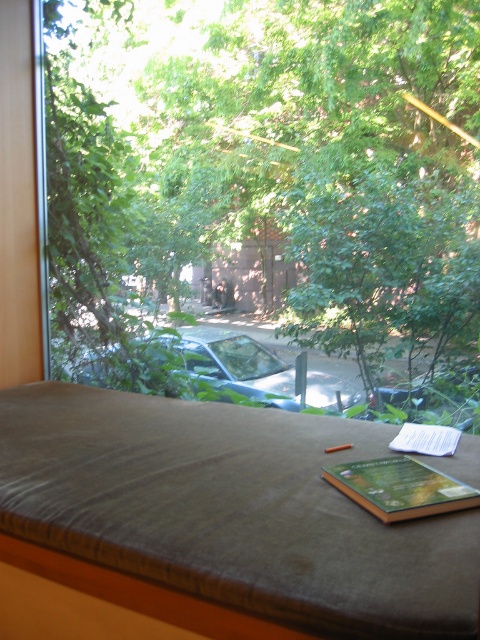
You are an interior designer planning to place a new floor lamp in this room. The lamp is 1.8 meters tall. Considering the height of the green leafy tree at center and the hardcover book at center, which object would the lamp be taller than?

The lamp at 1.8 meters would be taller than both the green leafy tree at center and the hardcover book at center since the tree is taller than the book, but the lamp is taller than the tree.

You are standing in the room and want to take a photo of the metallic silver car at center through the window. Considering the open book with green cover on the bench in front of the window, will the book block your view of the car?

The metallic silver car at center is 23.08 feet from viewer, so the distance is sufficient to avoid the open book with green cover on the bench blocking the view. You can take the photo without any obstruction.